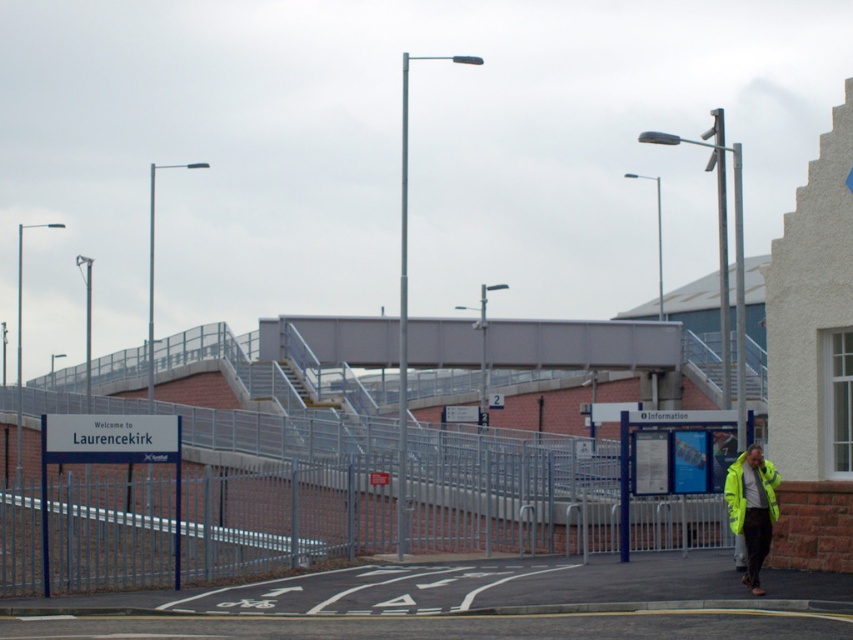
You are a delivery drone operator. Your drone needs to fly from the metallic silver fence at center to the high visibility yellow jacket at lower right. Given that the drone can carry a maximum payload of 10 pounds and has a battery that allows it to travel up to 100 feet, will it be able to make the trip without needing a recharge?

The metallic silver fence at center and high visibility yellow jacket at lower right are 72.14 feet apart. Since the drone can travel up to 100 feet on a single charge, it will have enough battery to complete the trip without needing a recharge.

You are a pedestrian trying to cross the street at the railway station. You see the metallic silver fence at center and the high visibility yellow jacket at lower right. Which object is wider from your perspective?

The metallic silver fence at center is wider than the high visibility yellow jacket at lower right.

You are a pedestrian trying to cross the street safely. You notice the metallic silver fence at center and the high visibility yellow jacket at lower right in your view. Which object is bigger in your field of view?

The metallic silver fence at center is larger in size compared to the high visibility yellow jacket at lower right, so the metallic silver fence at center appears bigger in your field of view.